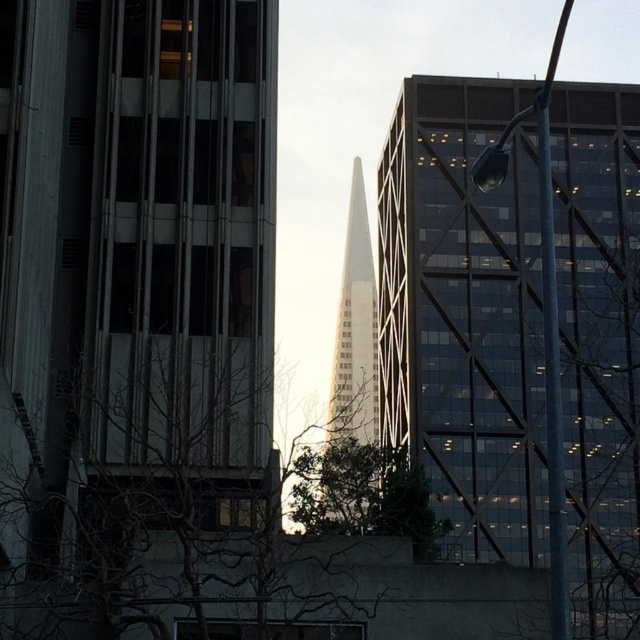
You are standing at the corner of the street and want to take a photo of the glassy reflective skyscraper at center. Where should you position yourself to capture it in the frame?

The glassy reflective skyscraper at center is located at point (465, 314), so you should position yourself directly in front of it to capture it in the frame.